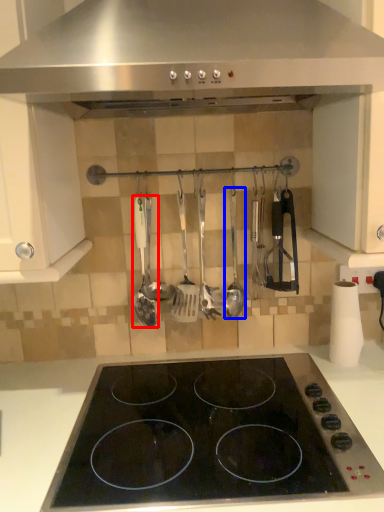
Question: Which point is further to the camera, spatula (highlighted by a red box) or spatula (highlighted by a blue box)?

Choices:
 (A) spatula
 (B) spatula

Answer: (B)